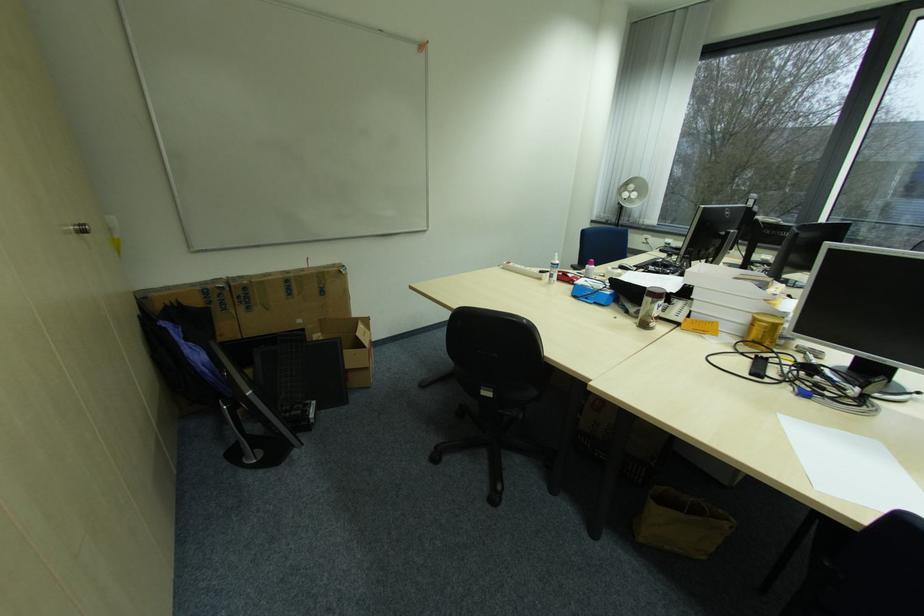
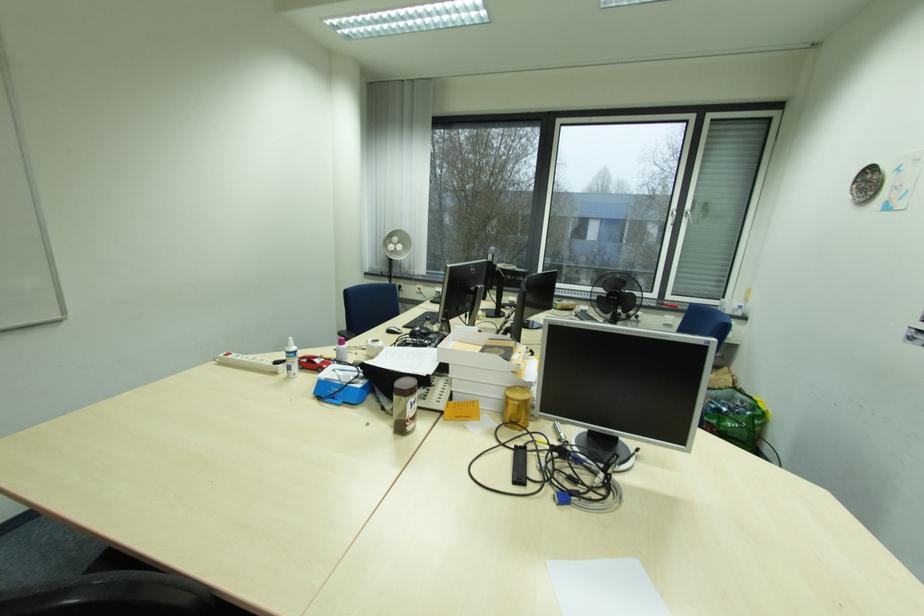
Question: The camera is either moving clockwise (left) or counter-clockwise (right) around the object. The first image is from the beginning of the video and the second image is from the end. Is the camera moving left or right when shooting the video?

Choices:
 (A) Left
 (B) Right

Answer: (A)